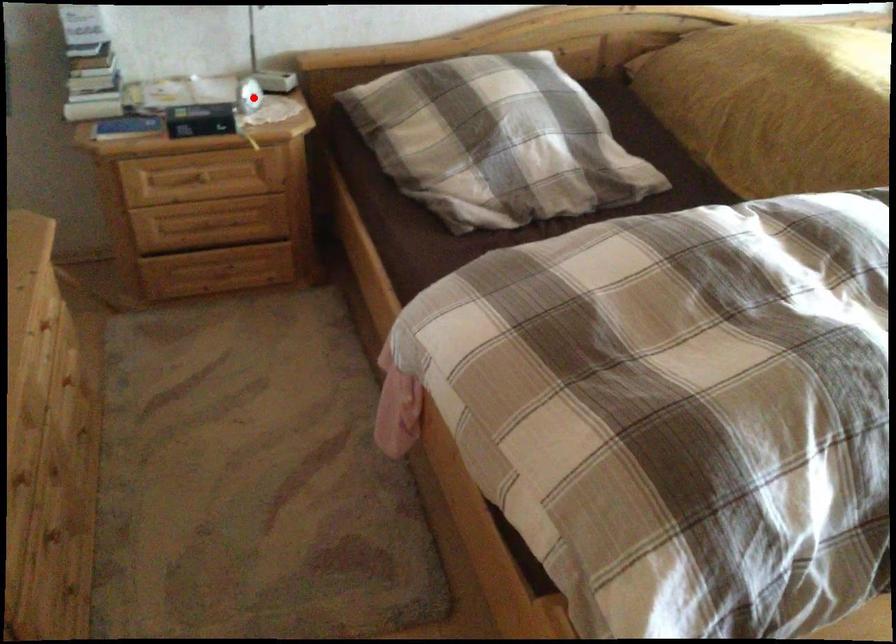
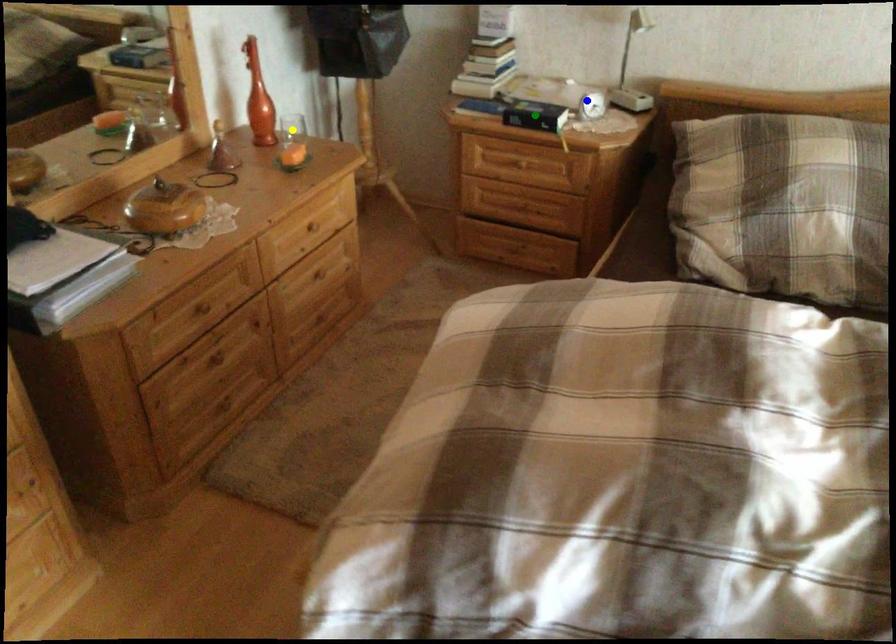
Question: I am providing you with two images of the same scene from different viewpoints. A red point is marked on the first image. You are given multiple points on the second image. Which point in image 2 is actually the same real-world point as the red point in image 1?

Choices:
 (A) yellow point
 (B) green point
 (C) blue point

Answer: (C)